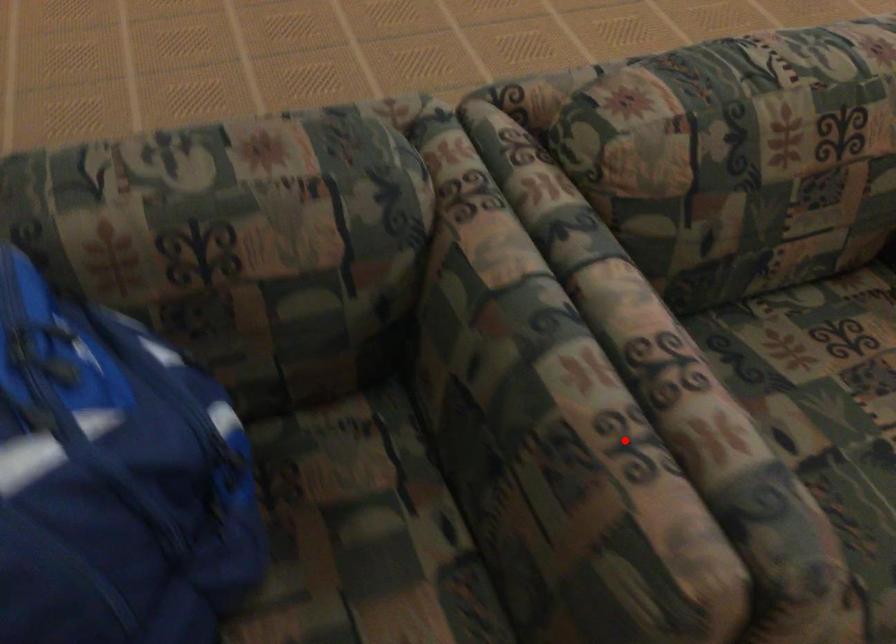
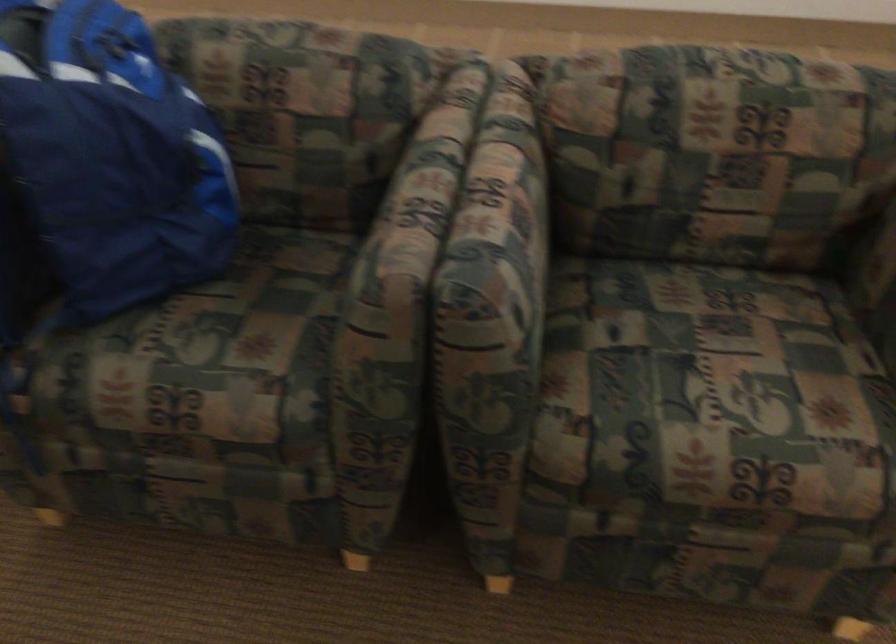
Question: I am providing you with two images of the same scene from different viewpoints. A red point is shown in image1. For the corresponding object point in image2, is it positioned nearer or farther from the camera?

Choices:
 (A) Nearer
 (B) Farther

Answer: (B)